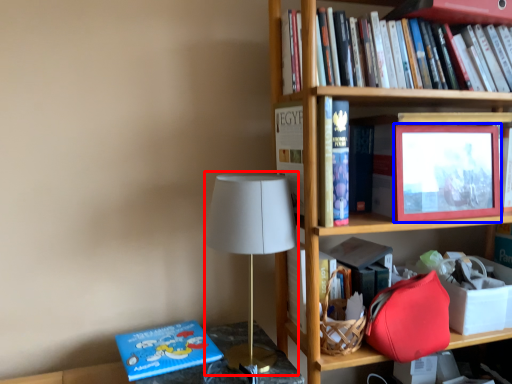
Question: Which object is closer to the camera taking this photo, table lamp (highlighted by a red box) or picture frame (highlighted by a blue box)?

Choices:
 (A) table lamp
 (B) picture frame

Answer: (A)